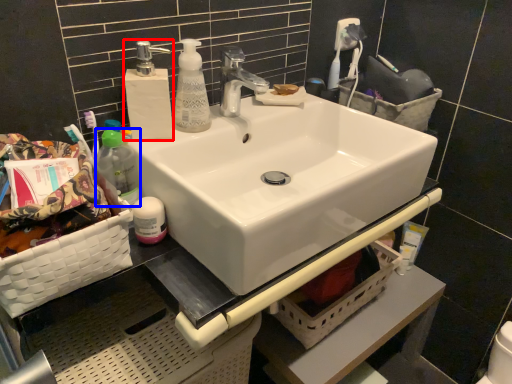
Question: Which of the following is the closest to the observer, soap dispenser (highlighted by a red box) or bottle (highlighted by a blue box)?

Choices:
 (A) soap dispenser
 (B) bottle

Answer: (B)